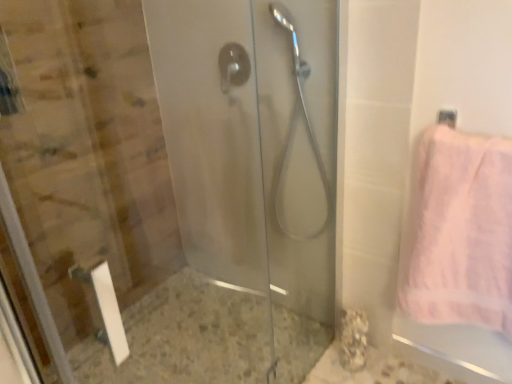
Question: Looking at the image, does satin nickel shower head at center, the 1th shower positioned from the right, seem bigger or smaller compared to transparent glass shower door at left?

Choices:
 (A) small
 (B) big

Answer: (A)

Question: From a real-world perspective, is satin nickel shower head at center, the second shower when ordered from left to right, above or below transparent glass shower door at left?

Choices:
 (A) below
 (B) above

Answer: (B)

Question: Which is farther from the pink fluffy towel at right?

Choices:
 (A) satin silver shower handle at center, which ranks as the first shower in left-to-right order
 (B) satin nickel shower head at center, the 1th shower positioned from the right
 (C) transparent glass shower door at left

Answer: (A)

Question: Estimate the real-world distances between objects in this image. Which object is farther from the pink fluffy towel at right?

Choices:
 (A) satin silver shower handle at center, which ranks as the first shower in left-to-right order
 (B) transparent glass shower door at left
 (C) satin nickel shower head at center, the 1th shower positioned from the right

Answer: (A)